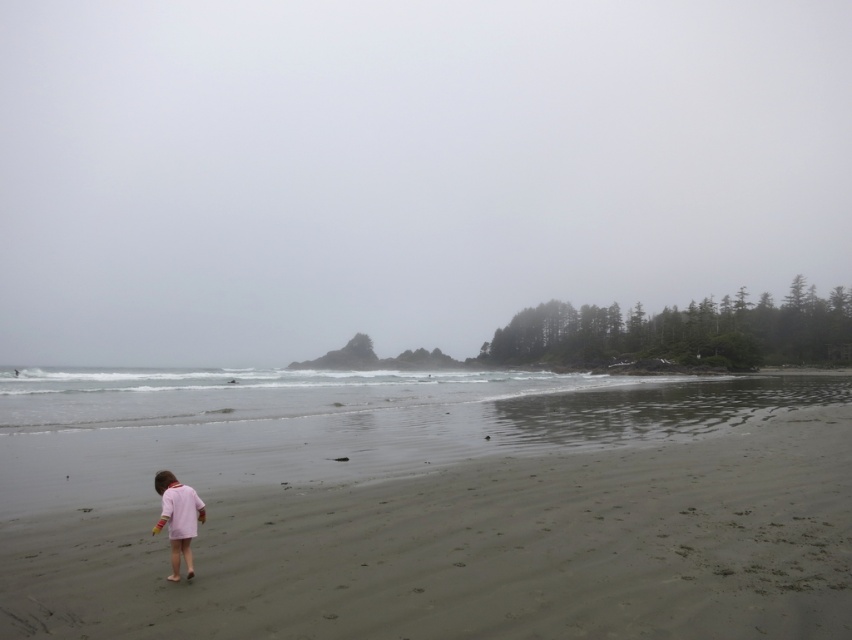
You are a photographer trying to capture the child in the pink matte dress at lower left while ensuring the smooth sand at lower center is visible in the frame. Given the spatial relationship between these two elements, will you need to adjust your camera angle to include both?

The smooth sand at lower center is larger in size than the pink matte dress at lower left, so you will need to adjust your camera angle to ensure both are visible in the frame.

Based on the scene, which object occupies a greater area in the image between the foggy sky at upper center and the smooth sand at lower center?

The foggy sky at upper center has a larger size compared to the smooth sand at lower center, so it occupies a greater area in the image.